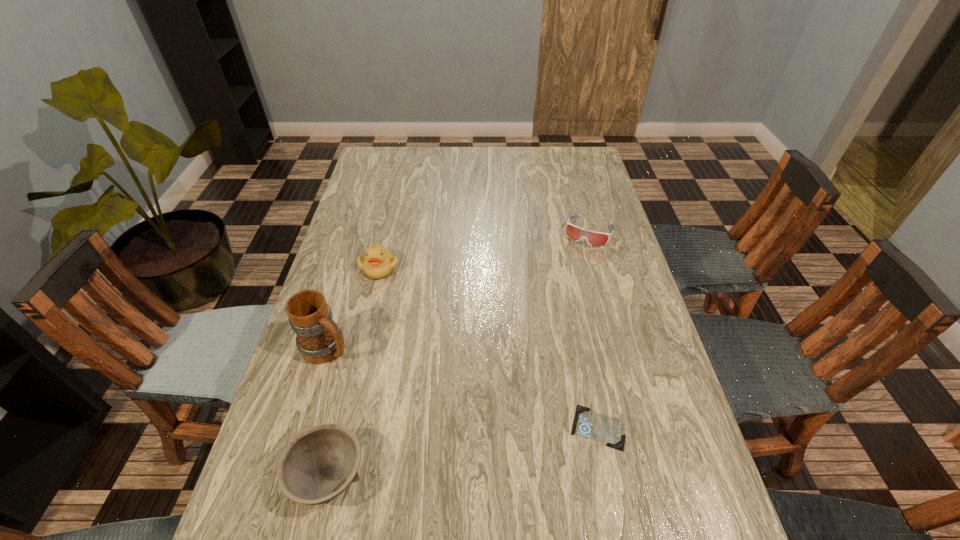
The image size is (960, 540). Find the location of `vacant point located between the fourth nearest object and the third farthest object`. vacant point located between the fourth nearest object and the third farthest object is located at coordinates (353, 308).

Locate an element on the screen. blank region between the fourth nearest object and the second shortest object is located at coordinates (484, 249).

Image resolution: width=960 pixels, height=540 pixels. In order to click on blank region between the farthest object and the bowl in this screenshot , I will do `click(459, 354)`.

What are the coordinates of `unoccupied position between the shortest object and the mug` in the screenshot? It's located at (463, 388).

At what (x,y) coordinates should I click in order to perform the action: click on free point between the third farthest object and the fourth shortest object. Please return your answer as a coordinate pair (x, y). Looking at the image, I should click on (353, 308).

Identify the location of vacant area that lies between the bowl and the goggles. (459, 354).

Image resolution: width=960 pixels, height=540 pixels. I want to click on unoccupied area between the duckling and the identity card, so coord(489,348).

The image size is (960, 540). Find the location of `free space that is in between the second tallest object and the third shortest object`. free space that is in between the second tallest object and the third shortest object is located at coordinates point(354,372).

You are a GUI agent. You are given a task and a screenshot of the screen. Output one action in this format:
    pyautogui.click(x=<x>, y=<y>)
    Task: Click on the vacant space that's between the third farthest object and the shortest object
    This screenshot has height=540, width=960.
    Given the screenshot: What is the action you would take?
    pyautogui.click(x=463, y=388)

Find the location of a particular element. This screenshot has width=960, height=540. blank region between the goggles and the identity card is located at coordinates (593, 329).